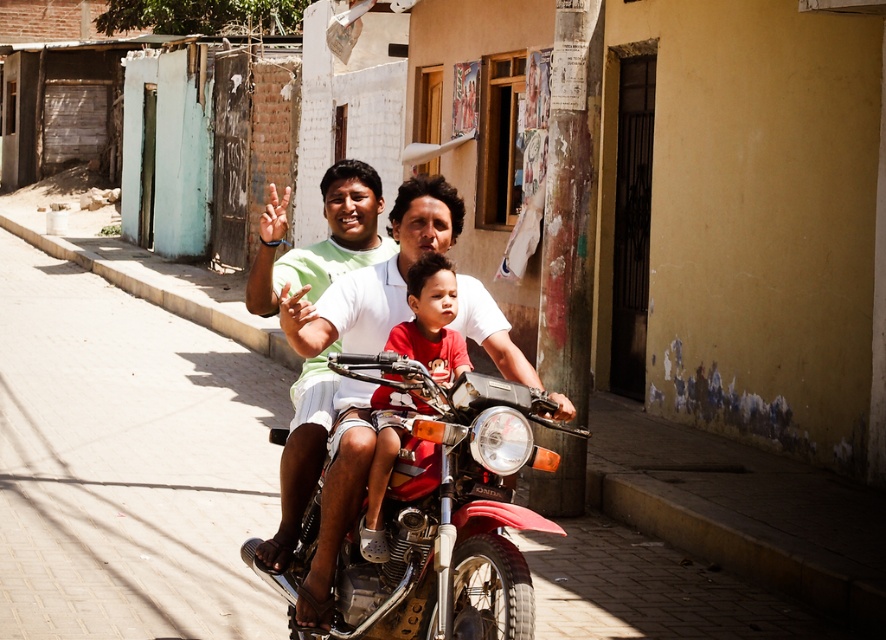
Question: Does metallic red motorcycle at center come in front of green matte shirt at center?

Choices:
 (A) yes
 (B) no

Answer: (A)

Question: In this image, where is green matte shirt at center located relative to red cotton shirt at center?

Choices:
 (A) below
 (B) above

Answer: (B)

Question: Which point is closer to the camera?

Choices:
 (A) (265, 272)
 (B) (364, 536)
 (C) (465, 552)

Answer: (C)

Question: Which of the following is the farthest from the observer?

Choices:
 (A) metallic red motorcycle at center
 (B) green matte shirt at center
 (C) red cotton shirt at center

Answer: (B)

Question: Is metallic red motorcycle at center smaller than green matte shirt at center?

Choices:
 (A) no
 (B) yes

Answer: (A)

Question: Among these points, which one is farthest from the camera?

Choices:
 (A) (255, 262)
 (B) (369, 557)
 (C) (394, 605)

Answer: (A)